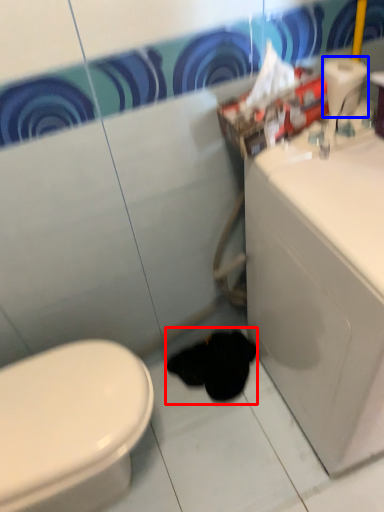
Question: Which object is closer to the camera taking this photo, animal (highlighted by a red box) or toilet paper (highlighted by a blue box)?

Choices:
 (A) animal
 (B) toilet paper

Answer: (B)